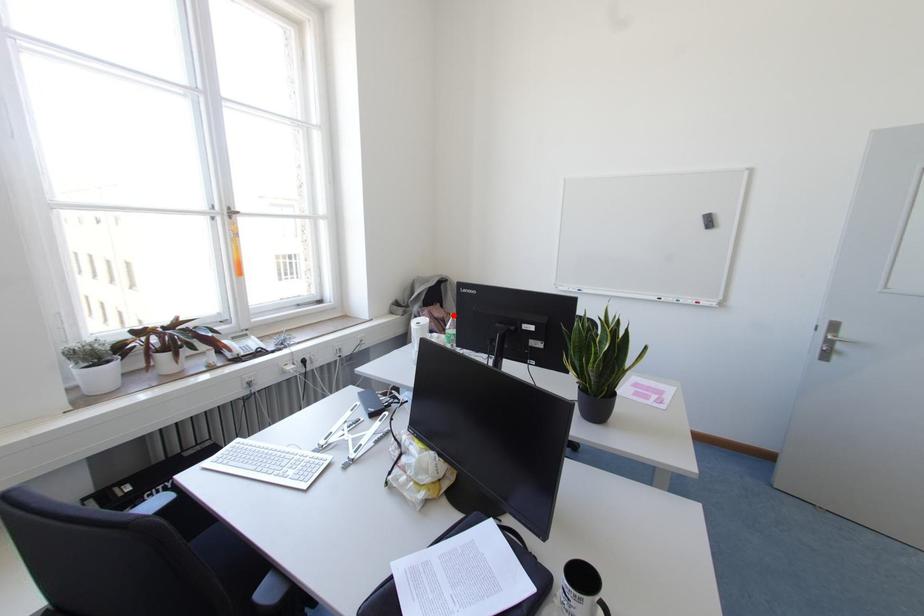
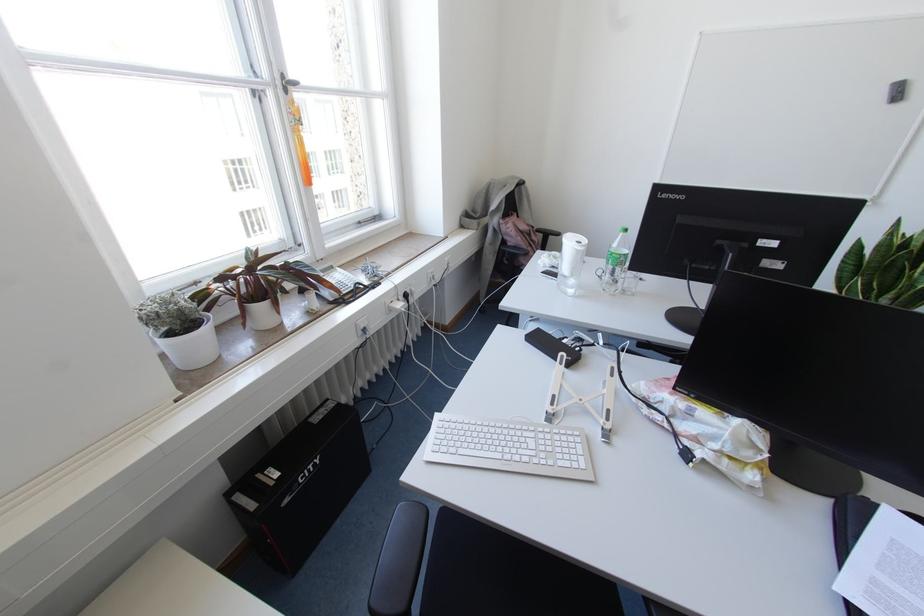
Where in the second image is the point corresponding to the highlighted location from the first image?

(625, 229)